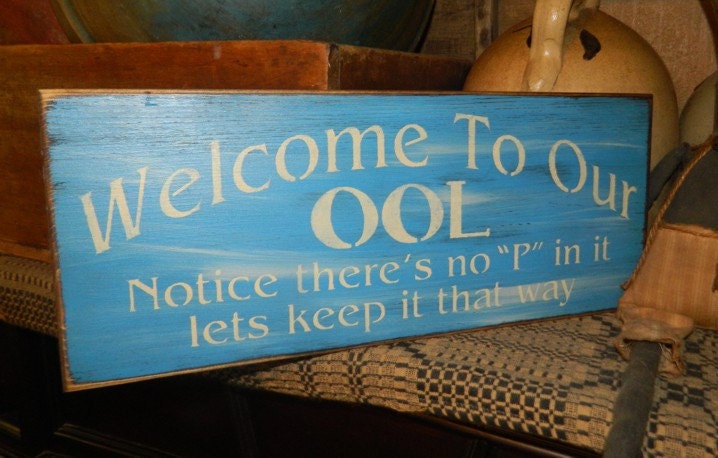
Where is `textiles`? The image size is (718, 458). textiles is located at coordinates (42, 293), (484, 385), (691, 404), (694, 269).